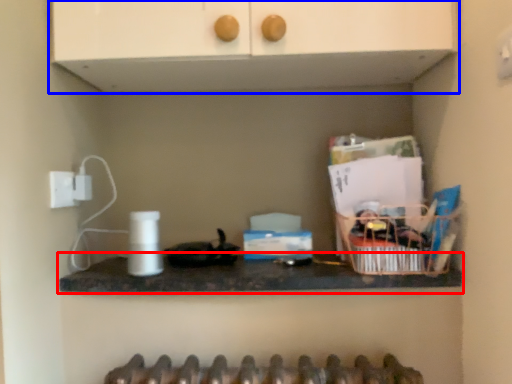
Question: Which object is closer to the camera taking this photo, countertop (highlighted by a red box) or cabinetry (highlighted by a blue box)?

Choices:
 (A) countertop
 (B) cabinetry

Answer: (B)